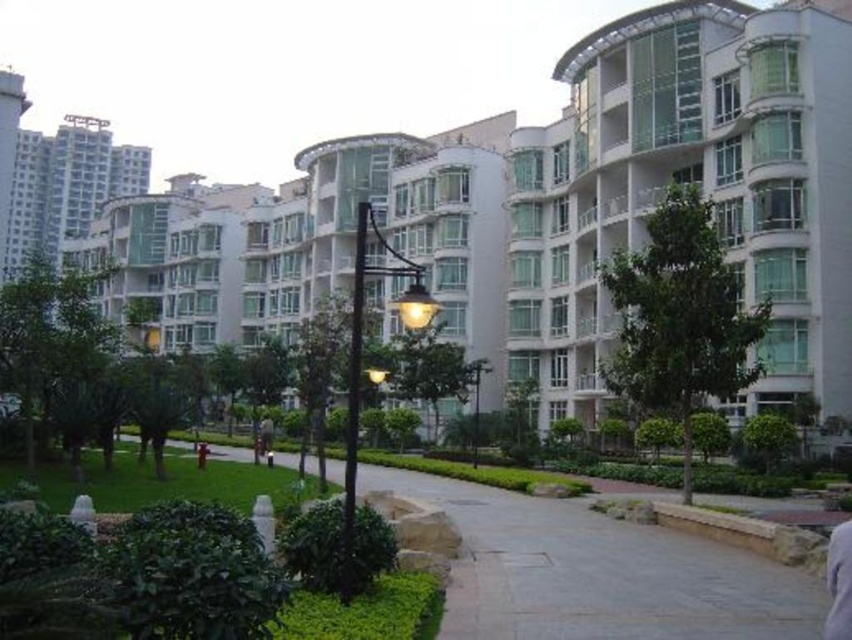
Question: Among these points, which one is farthest from the camera?

Choices:
 (A) (769, 600)
 (B) (258, 422)

Answer: (B)

Question: Does white glass condominium at upper center have a smaller size compared to smooth concrete path at center?

Choices:
 (A) no
 (B) yes

Answer: (A)

Question: Based on their relative distances, which object is nearer to the white glossy building at center?

Choices:
 (A) dark blue jeans at center
 (B) smooth concrete path at center
 (C) gray fabric shirt at lower right

Answer: (B)

Question: Does white glossy building at center appear under smooth concrete path at center?

Choices:
 (A) yes
 (B) no

Answer: (B)

Question: Considering the real-world distances, which object is farthest from the dark blue jeans at center?

Choices:
 (A) white glossy building at center
 (B) white glass condominium at upper center
 (C) smooth concrete path at center
 (D) gray fabric shirt at lower right

Answer: (D)

Question: Observing the image, what is the correct spatial positioning of gray fabric shirt at lower right in reference to dark blue jeans at center?

Choices:
 (A) left
 (B) right

Answer: (B)